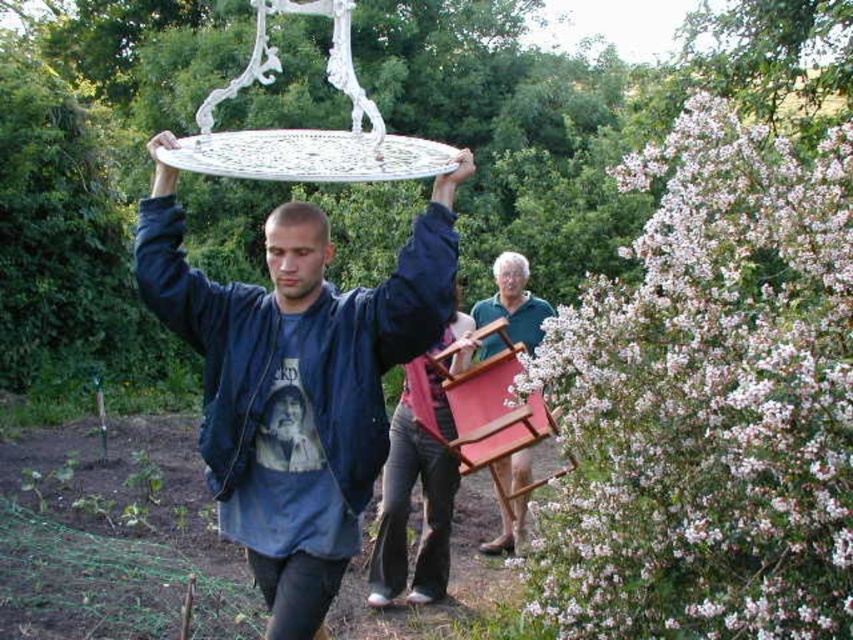
Question: Does matte white plate at center appear under wooden chair at center?

Choices:
 (A) no
 (B) yes

Answer: (A)

Question: Which object is farther from the camera taking this photo?

Choices:
 (A) matte white plate at center
 (B) gray hair at upper center
 (C) smooth blue shirt at center

Answer: (B)

Question: Does teal fabric shirt at center have a smaller size compared to gray hair at upper center?

Choices:
 (A) yes
 (B) no

Answer: (B)

Question: Which object is closer to the camera taking this photo?

Choices:
 (A) teal fabric shirt at center
 (B) matte black head at center

Answer: (B)

Question: Does matte white plate at center lie in front of matte black head at center?

Choices:
 (A) yes
 (B) no

Answer: (A)

Question: Estimate the real-world distances between objects in this image. Which object is closer to the matte white plate at center?

Choices:
 (A) teal fabric shirt at center
 (B) matte black head at center
 (C) matte black t-shirt at center

Answer: (C)